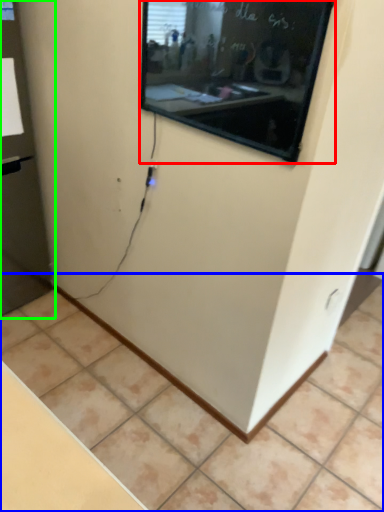
Question: Based on their relative distances, which object is farther from projection screen (highlighted by a red box)? Choose from tile (highlighted by a blue box) and glass door (highlighted by a green box).

Choices:
 (A) tile
 (B) glass door

Answer: (A)